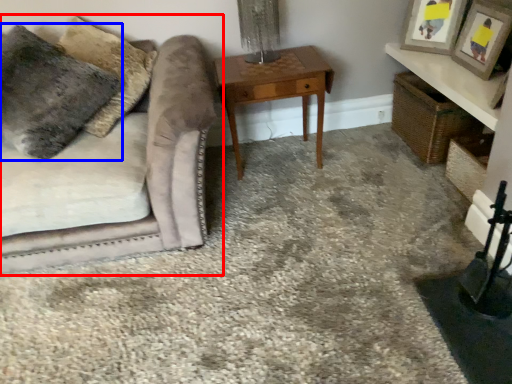
Question: Which point is further to the camera, studio couch (highlighted by a red box) or pillow (highlighted by a blue box)?

Choices:
 (A) studio couch
 (B) pillow

Answer: (B)